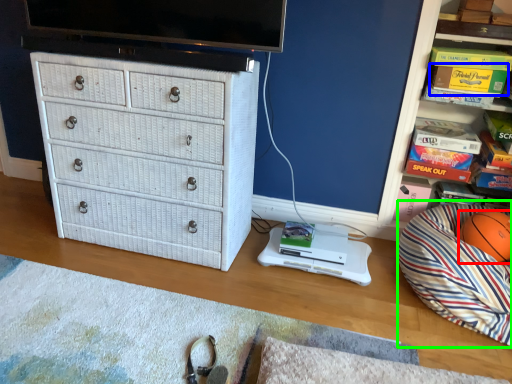
Question: Which object is the farthest from ball (highlighted by a red box)? Choose among these: magazine (highlighted by a blue box) or bean bag chair (highlighted by a green box).

Choices:
 (A) magazine
 (B) bean bag chair

Answer: (A)